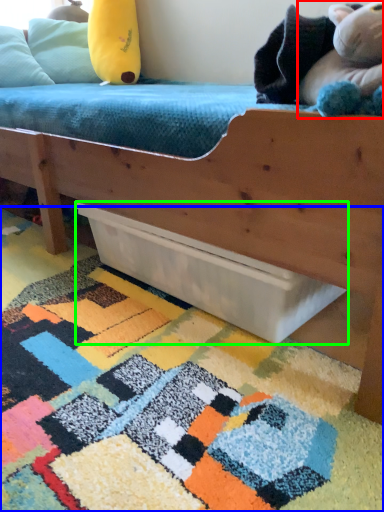
Question: Estimate the real-world distances between objects in this image. Which object is farther from toy (highlighted by a red box), mat (highlighted by a blue box) or drawer (highlighted by a green box)?

Choices:
 (A) mat
 (B) drawer

Answer: (A)